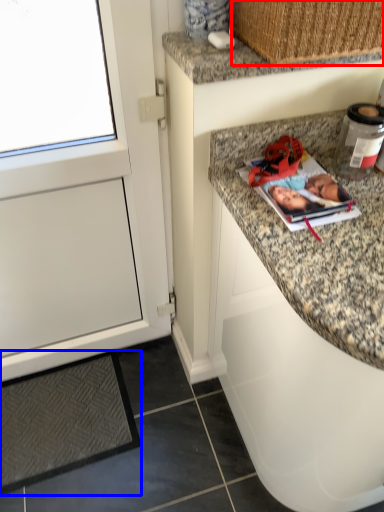
Question: Which of the following is the closest to the observer, basket (highlighted by a red box) or mat (highlighted by a blue box)?

Choices:
 (A) basket
 (B) mat

Answer: (A)